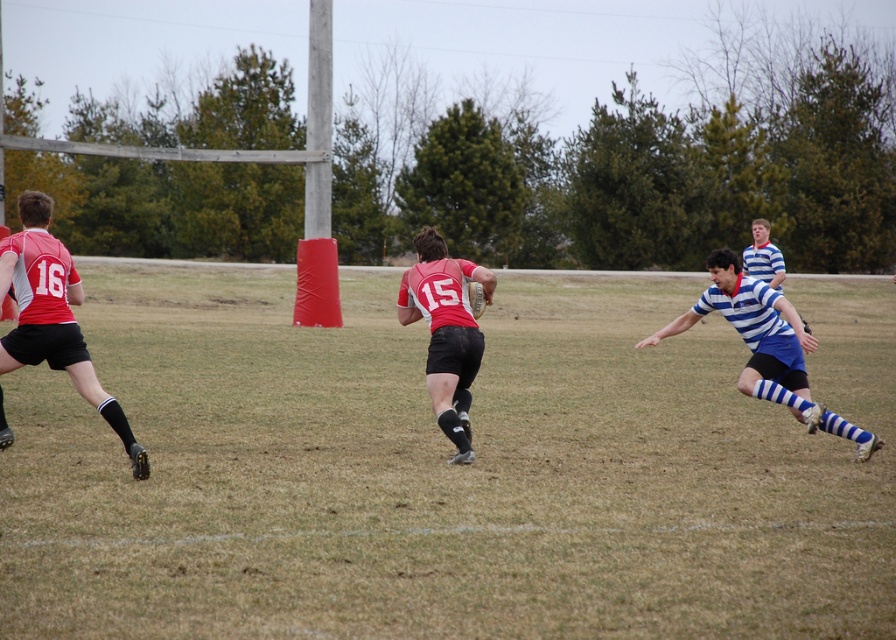
Question: Which of the following is the farthest from the observer?

Choices:
 (A) matte red jersey at center
 (B) green grass at center
 (C) blue striped jersey at right

Answer: (C)

Question: Among these objects, which one is farthest from the camera?

Choices:
 (A) green grass at center
 (B) blue striped jersey at right
 (C) matte red jersey at center

Answer: (B)

Question: Which point appears farthest from the camera in this image?

Choices:
 (A) (742, 525)
 (B) (737, 289)

Answer: (B)

Question: In this image, where is green grass at center located relative to blue striped jersey at right?

Choices:
 (A) right
 (B) left

Answer: (B)

Question: Can you confirm if green grass at center is positioned below matte red jersey at center?

Choices:
 (A) no
 (B) yes

Answer: (B)

Question: Where is green grass at center located in relation to matte red jersey at center in the image?

Choices:
 (A) above
 (B) below

Answer: (B)